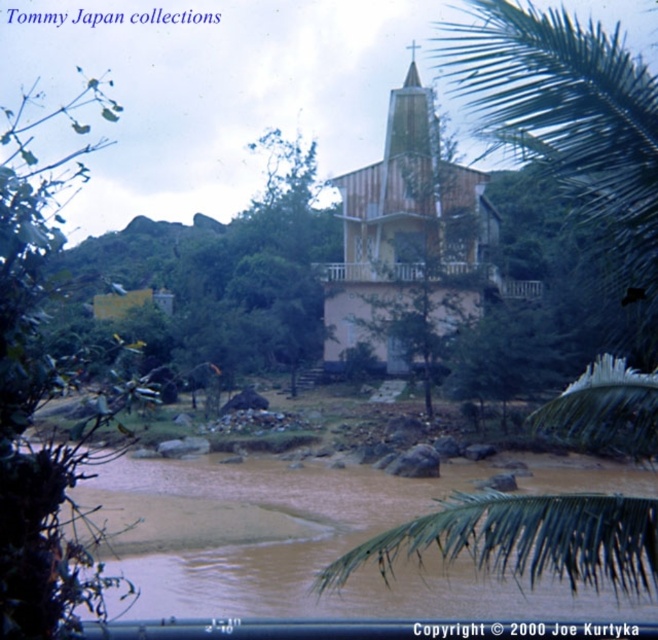
You are standing in front of the wooden church at center and want to cross the brown muddy water at lower center to reach the other side. Is the water close enough to the church for you to step onto it from where you are standing?

The brown muddy water at lower center is closer to the viewer than the wooden church at center, so yes, the water is close enough for you to step onto it from the church.

You are standing at the church and want to take a photo of both the point at coordinates point (599, 163) and point (84, 577). Which point will appear larger in the photo?

Point (599, 163) is further to the camera than point (84, 577), so the point (84, 577) will appear larger in the photo because it is closer to the camera.